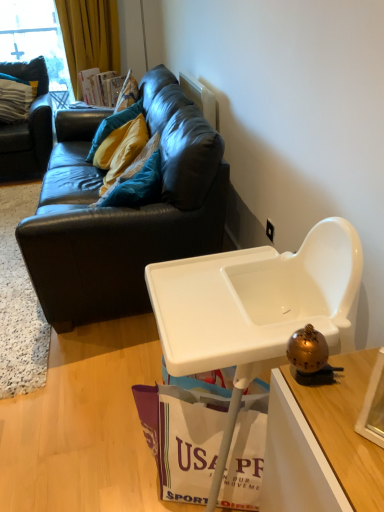
Identify the location of free space to the left of white paper shopping bag at lower center. (113, 463).